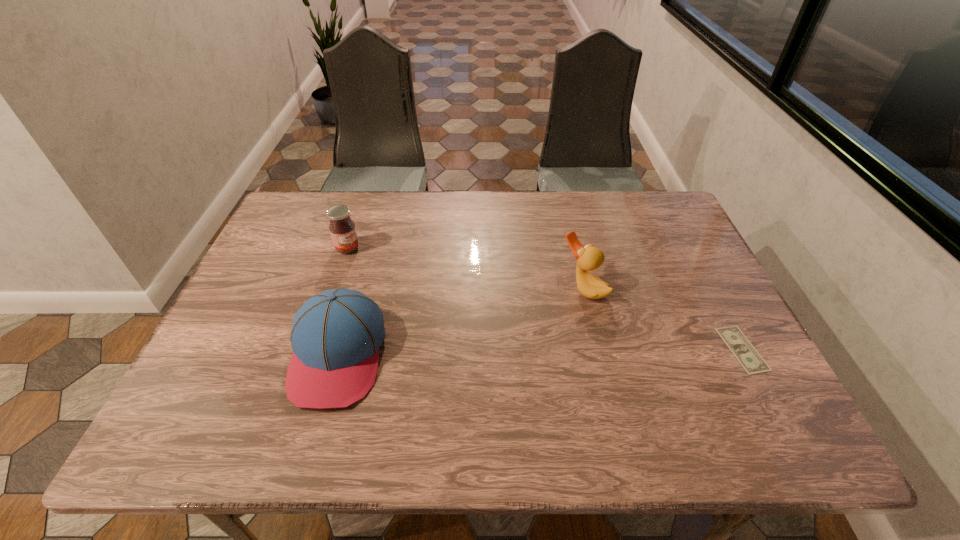
In order to click on vacant position at the right edge of the desktop in this screenshot , I will do `click(683, 257)`.

In the image, there is a desktop. Identify the location of vacant space at the far right corner. Image resolution: width=960 pixels, height=540 pixels. (676, 232).

In order to click on vacant region at the near right corner of the desktop in this screenshot , I will do `click(732, 372)`.

You are a GUI agent. You are given a task and a screenshot of the screen. Output one action in this format:
    pyautogui.click(x=<x>, y=<y>)
    Task: Click on the blank region between the jam and the money
    
    Given the screenshot: What is the action you would take?
    pyautogui.click(x=545, y=299)

This screenshot has height=540, width=960. I want to click on free space between the third object from left to right and the baseball cap, so click(x=461, y=322).

Find the location of a particular element. This screenshot has height=540, width=960. vacant space in between the second object from right to left and the baseball cap is located at coordinates (461, 322).

Where is `vacant area that lies between the money and the jam`? The image size is (960, 540). vacant area that lies between the money and the jam is located at coordinates (545, 299).

At what (x,y) coordinates should I click in order to perform the action: click on free space between the money and the baseball cap. Please return your answer as a coordinate pair (x, y). The image size is (960, 540). Looking at the image, I should click on (540, 352).

At what (x,y) coordinates should I click in order to perform the action: click on free space between the baseball cap and the third object from left to right. Please return your answer as a coordinate pair (x, y). This screenshot has width=960, height=540. Looking at the image, I should click on (461, 322).

This screenshot has height=540, width=960. In order to click on free spot between the second object from right to left and the jam in this screenshot , I will do `click(466, 268)`.